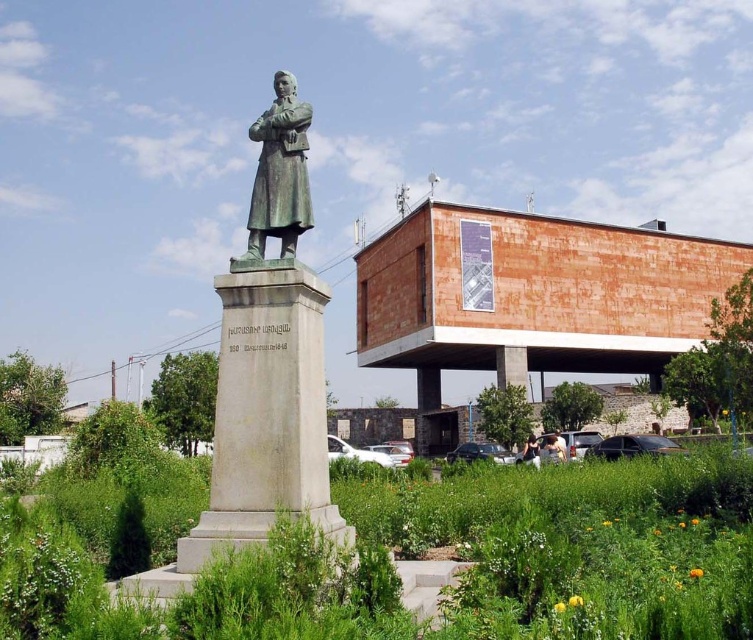
You are a tour guide leading a group to a modern building in the background. You want to ensure that your group can see both the green bronze statue at center and the modern building in the background clearly. What should you do?

Position the group at a distance where both the green bronze statue at center and the modern building in the background are visible. Since they are 36.32 feet apart, ensuring the group is positioned in an area that allows viewing of both without obstruction is key.